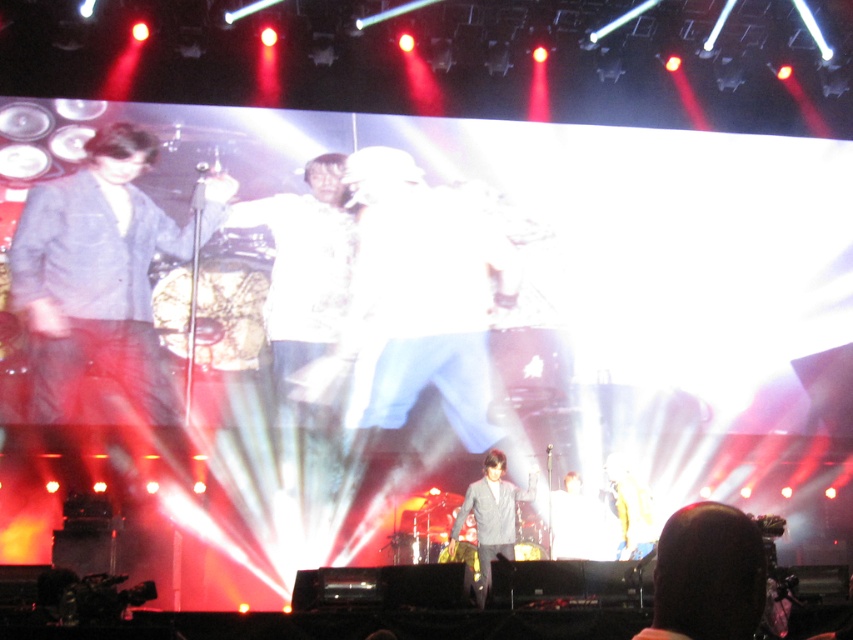
You are a photographer at the concert and want to capture a photo of both the dark brown hair at lower right and the gray wool jacket at center. Based on their heights, which one might you need to adjust your camera angle to focus on?

The dark brown hair at lower right is shorter than the gray wool jacket at center, so you might need to adjust your camera angle to focus on the dark brown hair at lower right since it is shorter and could be obscured by the taller gray wool jacket at center.

You are standing at the concert venue and want to know how far you are from the point marked as point (x=753, y=602). Can you determine the distance?

The distance between point (x=753, y=602) and the viewer is 7.89 feet.